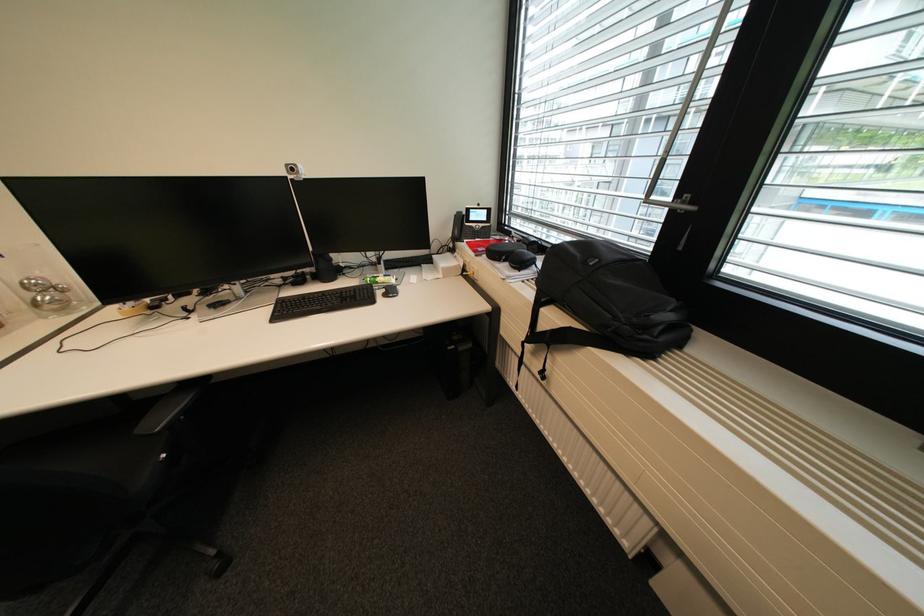
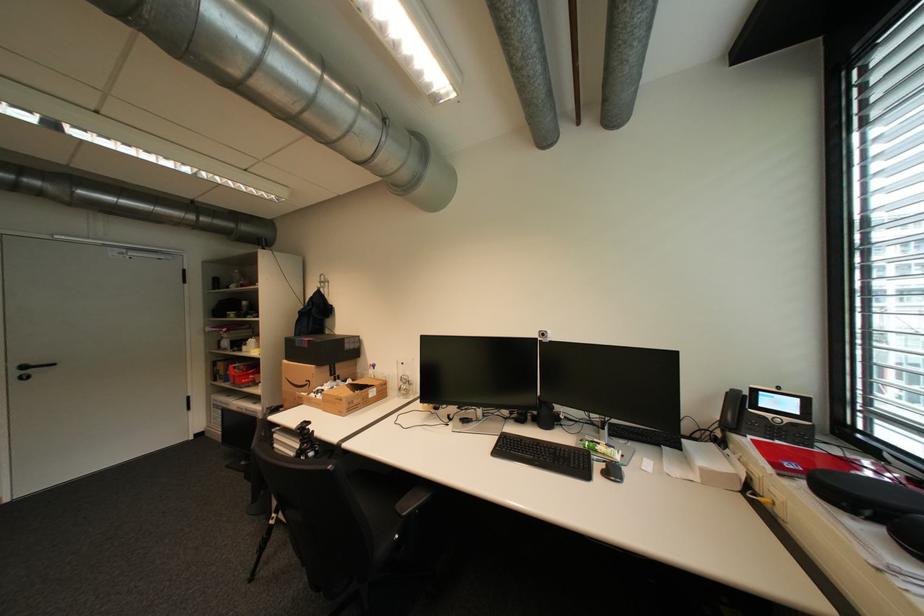
The point at (x=172, y=456) is marked in the first image. Where is the corresponding point in the second image?

(406, 537)